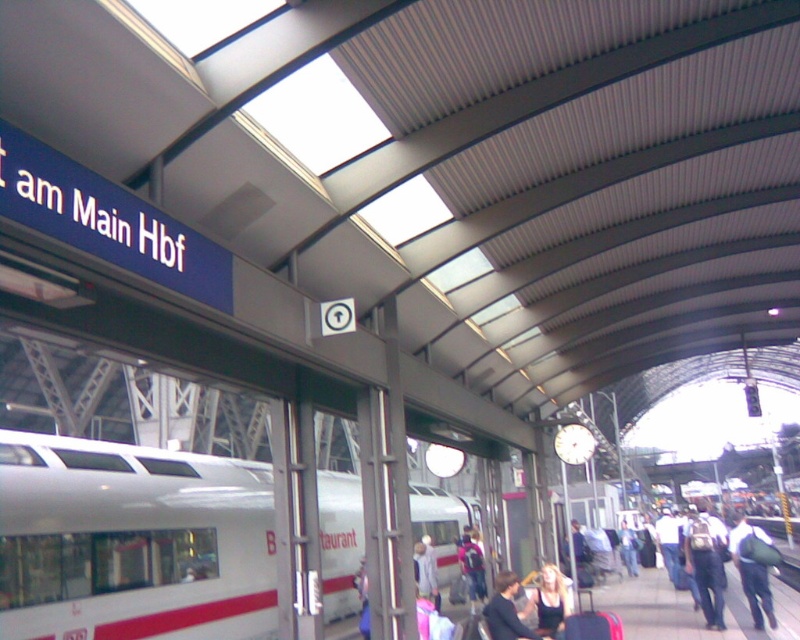
You are standing at the platform of the train station and want to walk from point A to point B. If point A is at point [550,577] and point B is at point [768,624], which direction should you move to reach point B from point A?

To reach point B at [768,624] from point A at [550,577], you should move forward since point B is behind point A.

You are a delivery robot with a 10 meter range. You need to deliver a package from the green fabric backpack at lower right to the matte black shirt at center. Can you complete the delivery without needing to recharge?

The distance between the green fabric backpack at lower right and the matte black shirt at center is 9.31 meters, so yes, the delivery robot can complete the delivery without needing to recharge since it is within the 10 meter range.

You are a traveler at the train station platform. You see a green fabric backpack at lower right and a light brown leather jacket at lower right. Which item is closer to you?

The green fabric backpack at lower right is closer to you because it is in front of the light brown leather jacket at lower right.